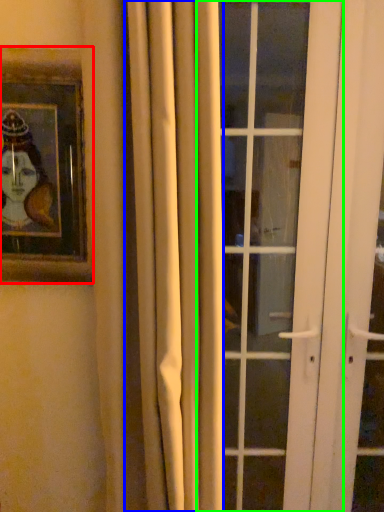
Question: Based on their relative distances, which object is farther from picture frame (highlighted by a red box)? Choose from curtain (highlighted by a blue box) and door (highlighted by a green box).

Choices:
 (A) curtain
 (B) door

Answer: (B)